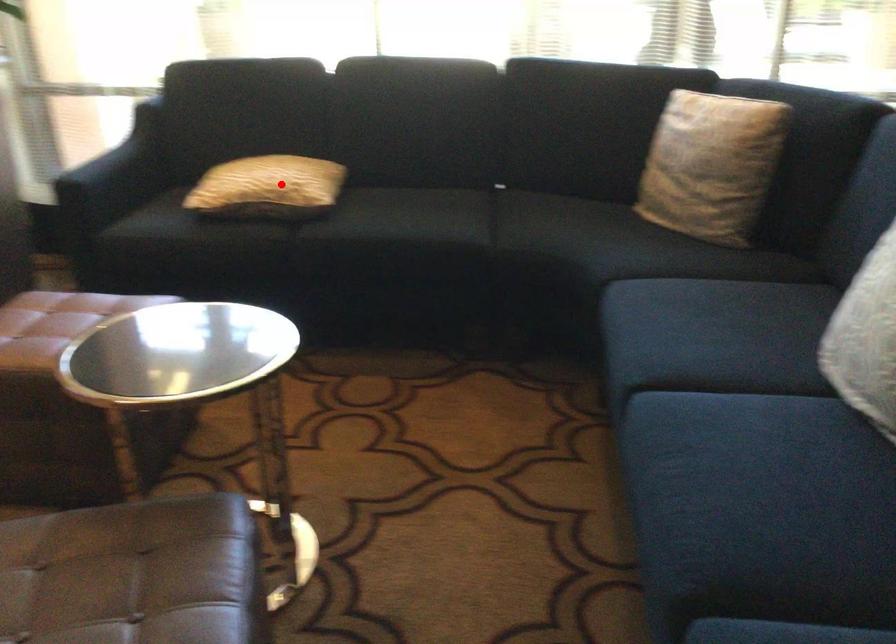
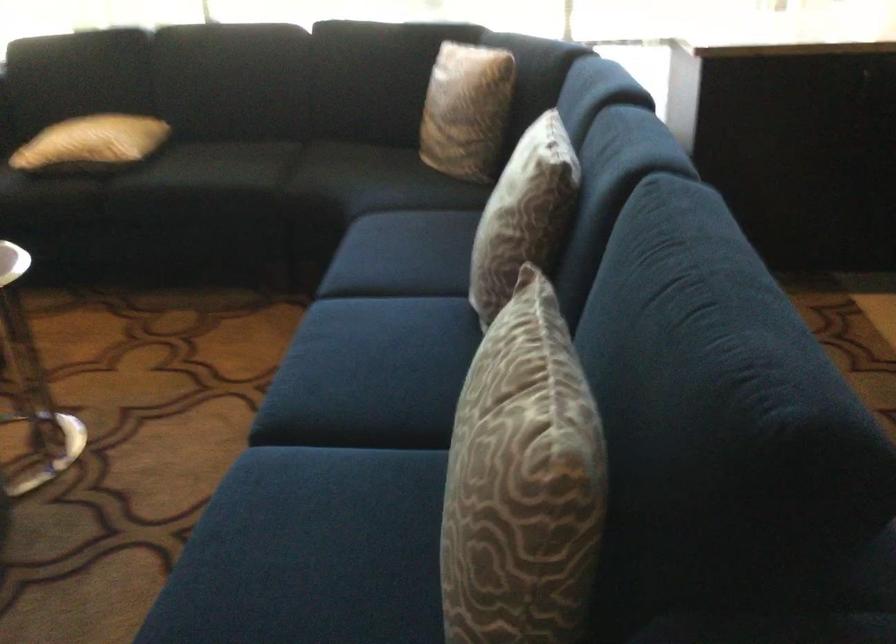
The point at the highlighted location is marked in the first image. Where is the corresponding point in the second image?

(91, 142)